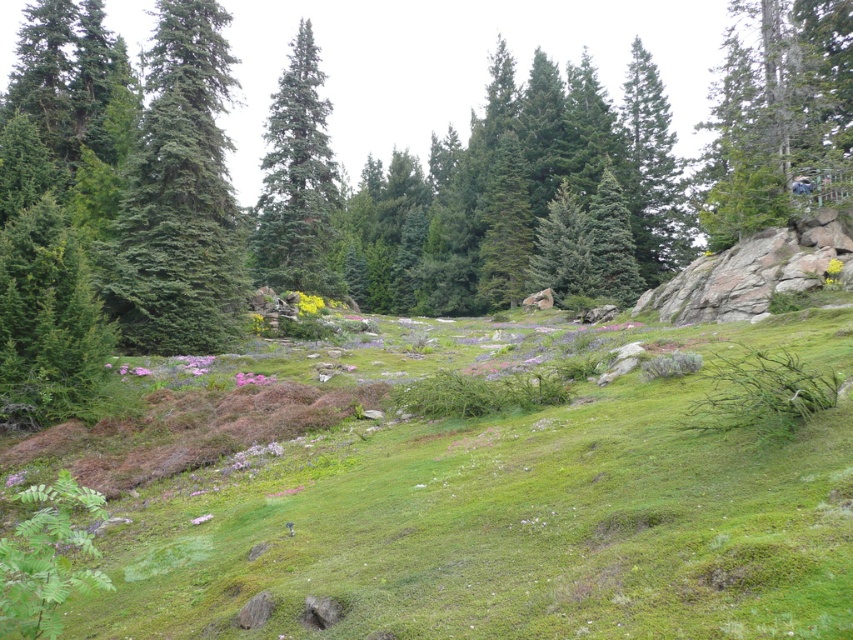
This screenshot has width=853, height=640. Find the location of `green grassy at lower left`. green grassy at lower left is located at coordinates (514, 518).

Who is more forward, (699, 384) or (323, 136)?

Point (699, 384) is more forward.

Is point (131, 618) less distant than point (262, 220)?

Yes, it is.

Find the location of a particular element. The height and width of the screenshot is (640, 853). green grassy at lower left is located at coordinates (514, 518).

Is green needle-like at left to the left of green textured pine tree at center from the viewer's perspective?

In fact, green needle-like at left is to the right of green textured pine tree at center.

Does point (119, 216) lie behind point (328, 177)?

No.

Image resolution: width=853 pixels, height=640 pixels. What are the coordinates of `green needle-like at left` in the screenshot? It's located at (178, 198).

Can you confirm if green grassy at lower left is positioned to the right of green needle-like at left?

Correct, you'll find green grassy at lower left to the right of green needle-like at left.

Which is more to the right, green grassy at lower left or green needle-like at left?

From the viewer's perspective, green grassy at lower left appears more on the right side.

Is point (312, 433) closer to viewer compared to point (173, 172)?

Yes.

Locate an element on the screen. The width and height of the screenshot is (853, 640). green grassy at lower left is located at coordinates (514, 518).